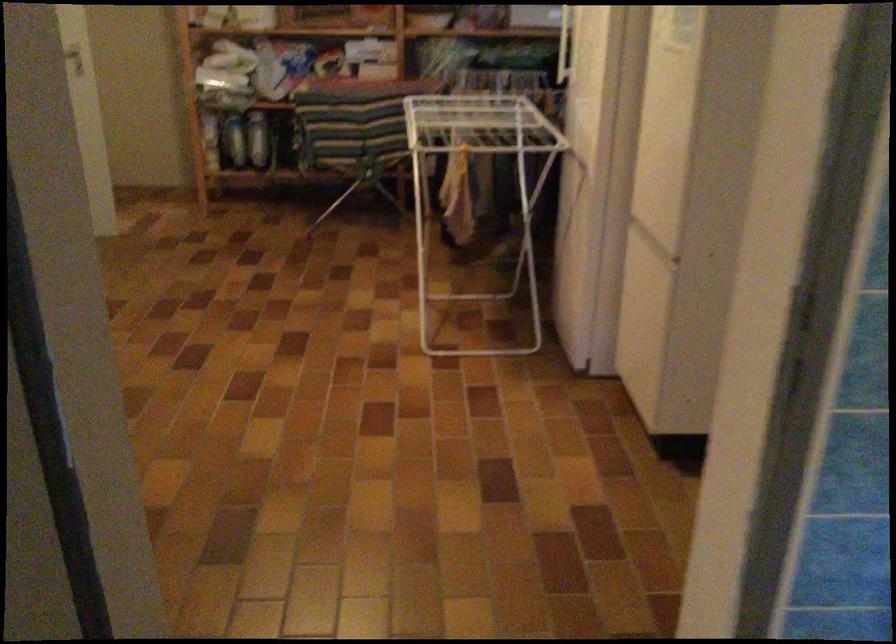
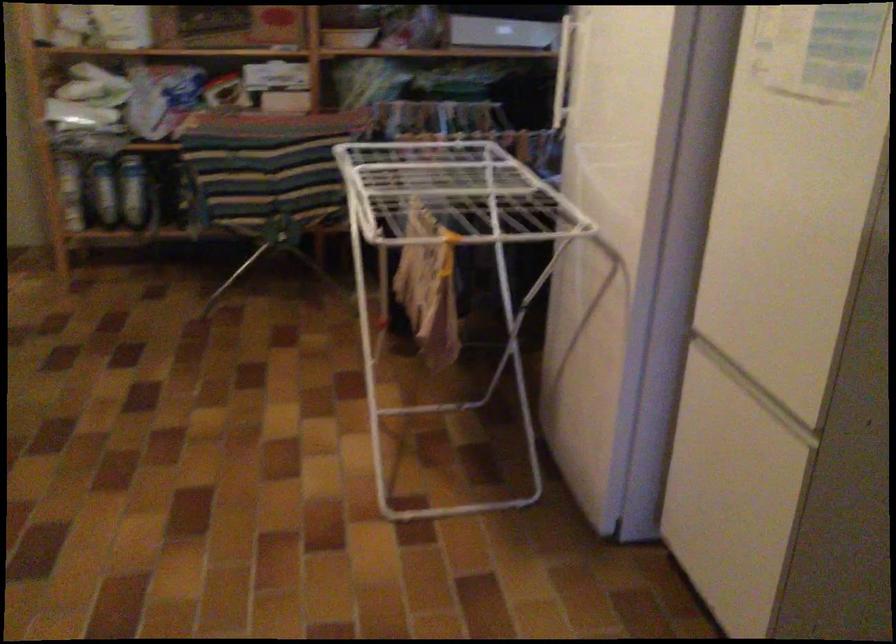
Locate, in the second image, the point that corresponds to the point at 227,140 in the first image.

(101, 191)